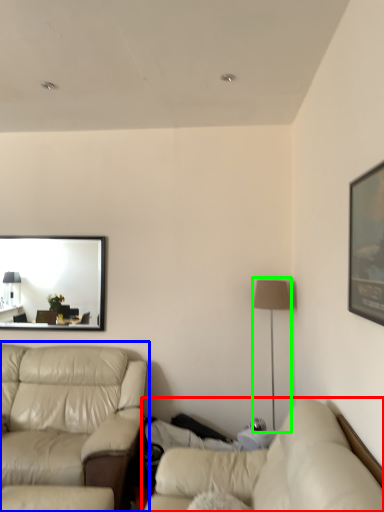
Question: Considering the real-world distances, which object is closest to studio couch (highlighted by a red box)? studio couch (highlighted by a blue box) or table lamp (highlighted by a green box).

Choices:
 (A) studio couch
 (B) table lamp

Answer: (A)